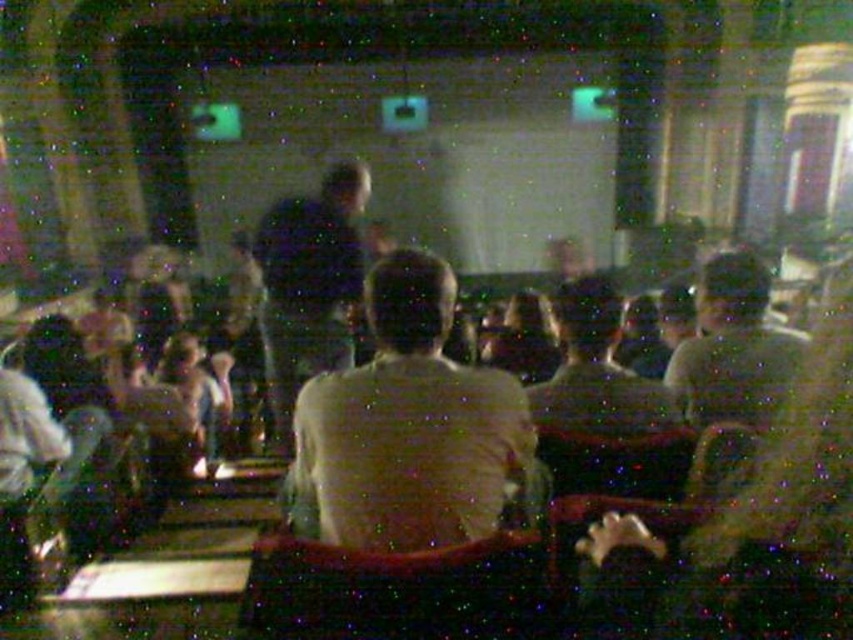
Between point (358, 442) and point (268, 369), which one is positioned behind?

Positioned behind is point (268, 369).

Which of these two, light brown shirt at center or dark blue shirt at center, stands shorter?

dark blue shirt at center

Is point (322, 456) behind point (318, 253)?

No, it is not.

Locate an element on the screen. This screenshot has height=640, width=853. light brown shirt at center is located at coordinates (407, 428).

Is dark blue shirt at center behind light brown leather jacket at center?

Yes, it is.

Is point (360, 269) positioned after point (741, 291)?

Yes, point (360, 269) is farther from viewer.

Is point (339, 328) positioned in front of point (757, 352)?

No, it is not.

Find the location of a particular element. The height and width of the screenshot is (640, 853). dark blue shirt at center is located at coordinates (309, 284).

Is light brown shirt at center bigger than light brown leather jacket at center?

Correct, light brown shirt at center is larger in size than light brown leather jacket at center.

In the scene shown: Measure the distance between light brown shirt at center and light brown leather jacket at center.

light brown shirt at center and light brown leather jacket at center are 37.59 inches apart.

This screenshot has height=640, width=853. I want to click on light brown shirt at center, so click(x=407, y=428).